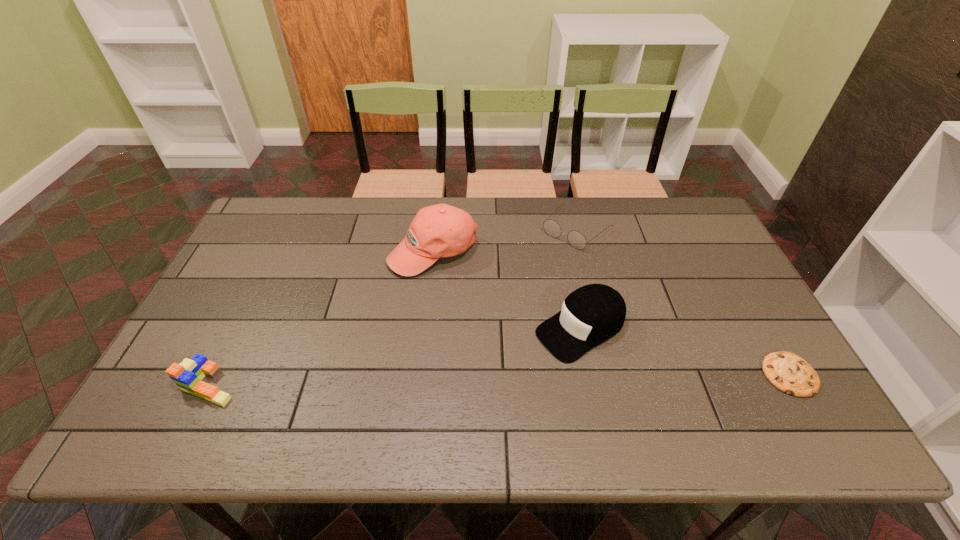
Locate an element on the screen. This screenshot has height=540, width=960. vacant space at the far right corner of the desktop is located at coordinates (667, 210).

This screenshot has height=540, width=960. I want to click on vacant area that lies between the tallest object and the cap, so click(x=507, y=290).

This screenshot has width=960, height=540. I want to click on free space that is in between the cap and the rightmost object, so coord(685,352).

Where is `vacant space in between the baseball cap and the fourth tallest object`? vacant space in between the baseball cap and the fourth tallest object is located at coordinates (505, 240).

Locate an element on the screen. empty location between the tallest object and the fourth tallest object is located at coordinates click(x=505, y=240).

You are a GUI agent. You are given a task and a screenshot of the screen. Output one action in this format:
    pyautogui.click(x=<x>, y=<y>)
    Task: Click on the free space between the shortest object and the Lego
    
    Given the screenshot: What is the action you would take?
    pyautogui.click(x=500, y=380)

The width and height of the screenshot is (960, 540). I want to click on empty location between the leftmost object and the shortest object, so [x=500, y=380].

Identify the location of unoccupied position between the second object from left to right and the cap. (507, 290).

Image resolution: width=960 pixels, height=540 pixels. In order to click on empty location between the second shortest object and the Lego in this screenshot , I will do `click(394, 307)`.

Where is `vacant region between the second object from left to right and the Lego`? Image resolution: width=960 pixels, height=540 pixels. vacant region between the second object from left to right and the Lego is located at coordinates (322, 318).